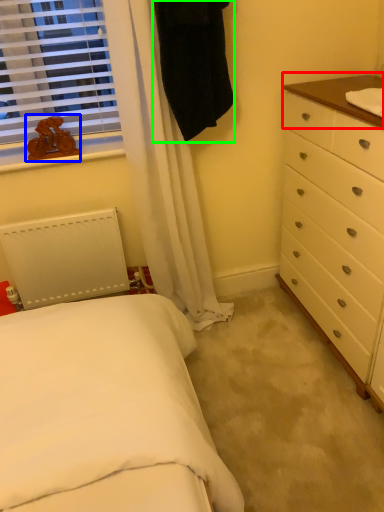
Question: Which object is positioned farthest from counter top (highlighted by a red box)? Select from toy (highlighted by a blue box) and robe (highlighted by a green box).

Choices:
 (A) toy
 (B) robe

Answer: (A)